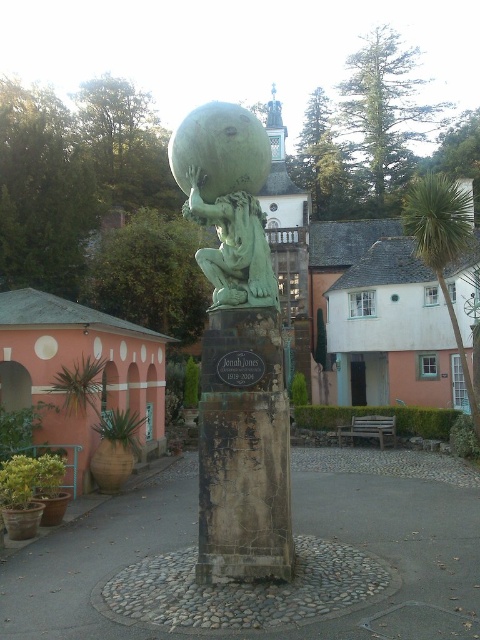
Does green stone statue at center appear on the right side of green leafy palm tree at upper right?

In fact, green stone statue at center is to the left of green leafy palm tree at upper right.

This screenshot has height=640, width=480. Find the location of `green stone statue at center`. green stone statue at center is located at coordinates pyautogui.click(x=233, y=248).

Locate an element on the screen. The image size is (480, 640). green stone statue at center is located at coordinates (233, 248).